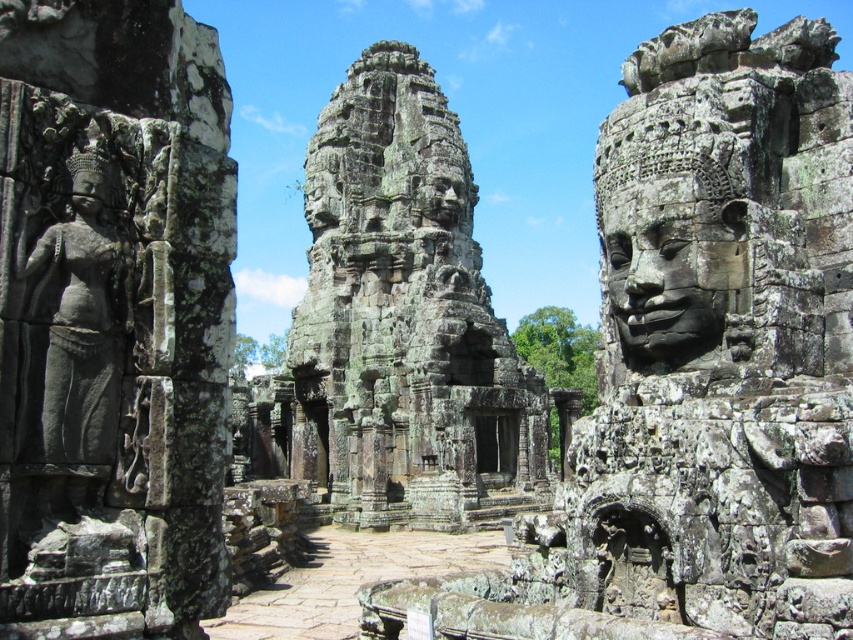
You are an archaeologist standing at the center of the temple complex. You need to locate the gray stone statue at left. According to the coordinates, where would you find it?

The gray stone statue at left is located at coordinates point (73,332).

You are an archaeologist measuring the width of the rough stone temple at center and the matte stone face at left. Which object has a greater width?

The rough stone temple at center might be wider than matte stone face at left.

You are an archaeologist examining the ancient temple site. You notice the rough stone temple at center and the matte stone face at left. Which of these two objects is positioned to the left of the other?

The rough stone temple at center is positioned to the left of the matte stone face at left.